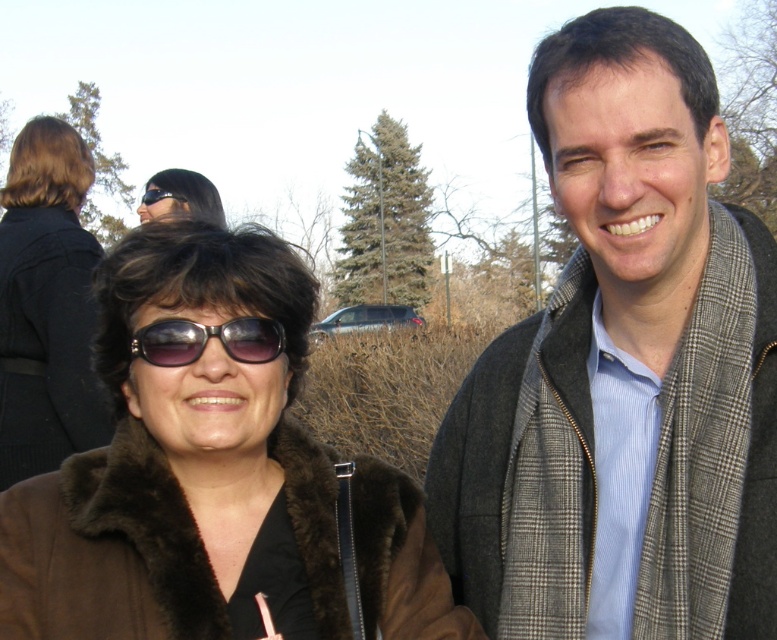
You are a photographer trying to focus on the plaid scarf at center and sunglasses at center in the image. Which object should you adjust your camera lens to focus on first if you want to capture both in sharp detail?

The plaid scarf at center is closer to the viewer than the sunglasses at center, so you should focus on the plaid scarf at center first to ensure both are in sharp detail.

You are standing in front of a group photo of two people. You notice a black fuzzy coat at left and sunglasses at center. Which item is located more to the left?

The black fuzzy coat at left is more to the left than the sunglasses at center.

You are a photographer trying to capture a group photo of the two people in the scene. The camera you are using has a maximum width limit of 1.2 meters for the subjects to fit in the frame. Given that the brown fur coat at left is wider than the sunglasses at center, will the two people fit within the camera frame?

The brown fur coat at left is wider than the sunglasses at center. However, the total width of both individuals combined must be considered. Since the camera has a maximum width limit of 1.2 meters, it is uncertain without knowing their combined width. The question does not provide enough information about their total width, only the relative sizes of the coat and sunglasses.